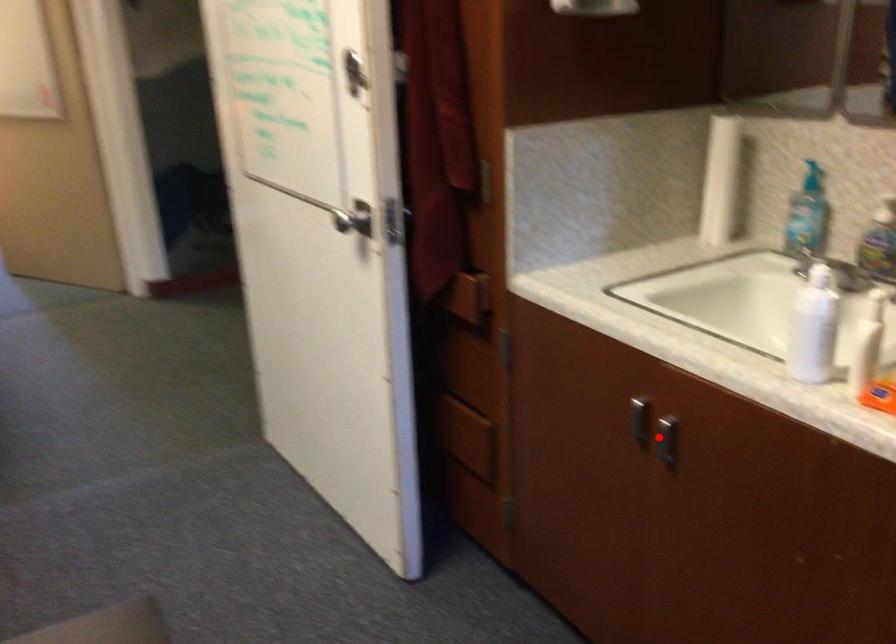
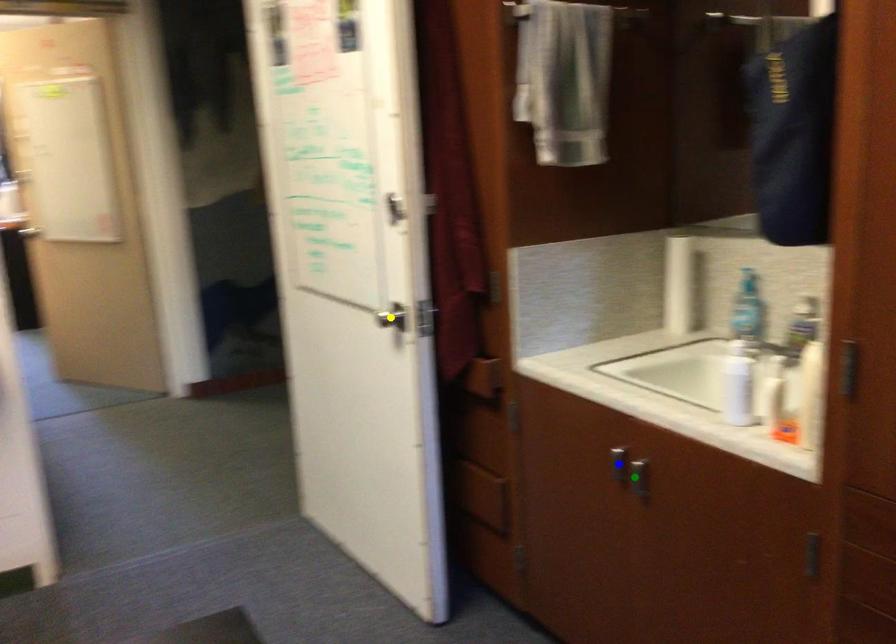
Question: I am providing you with two images of the same scene from different viewpoints. A red point is marked on the first image. You are given multiple points on the second image. Which point in image 2 represents the same 3d spot as the red point in image 1?

Choices:
 (A) green point
 (B) yellow point
 (C) blue point

Answer: (A)